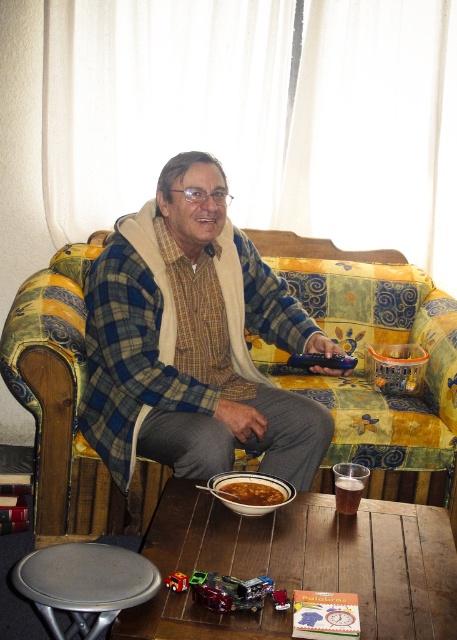
Based on the photo, how far apart are gray fabric stool at lower left and translucent plastic cup at lower center?

gray fabric stool at lower left is 25.41 inches from translucent plastic cup at lower center.

Is gray fabric stool at lower left wider than translucent plastic cup at lower center?

Yes, gray fabric stool at lower left is wider than translucent plastic cup at lower center.

Is point (38, 568) positioned after point (349, 500)?

No, it is in front of (349, 500).

The image size is (457, 640). In order to click on gray fabric stool at lower left in this screenshot , I will do `click(85, 582)`.

Identify the location of wooden table at center. The width and height of the screenshot is (457, 640). (299, 564).

At what (x,y) coordinates should I click in order to perform the action: click on wooden table at center. Please return your answer as a coordinate pair (x, y). Looking at the image, I should click on (299, 564).

Can you confirm if brown matte bowl at lower center is positioned below translucent plastic cup at lower center?

Incorrect, brown matte bowl at lower center is not positioned below translucent plastic cup at lower center.

Which is in front, point (255, 502) or point (352, 506)?

Point (255, 502)

Does point (271, 496) come behind point (340, 496)?

Yes, point (271, 496) is behind point (340, 496).

Find the location of a particular element. The height and width of the screenshot is (640, 457). brown matte bowl at lower center is located at coordinates (251, 493).